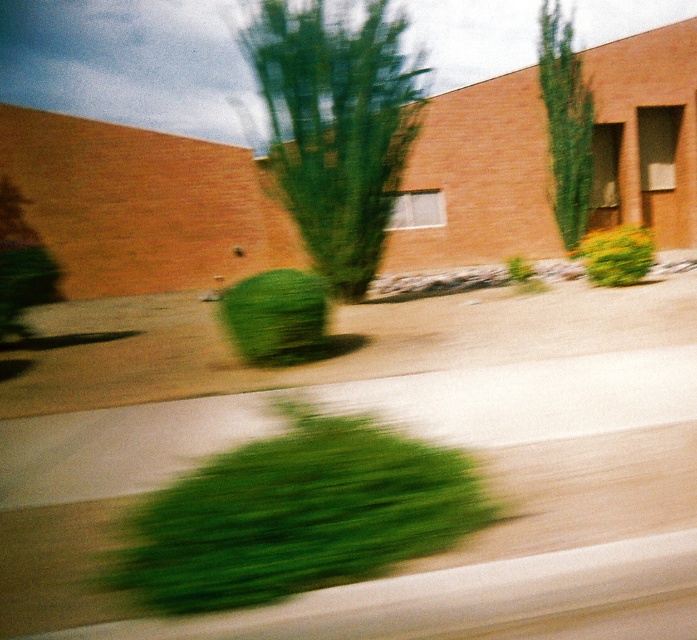
Who is more forward, [183,566] or [606,260]?

Point [183,566] is in front.

Can you confirm if green leafy hedge at lower center is wider than yellow-green textured bush at center-right?

No, green leafy hedge at lower center is not wider than yellow-green textured bush at center-right.

Is point (222, 486) farther from camera compared to point (574, 253)?

No, it is not.

Locate an element on the screen. The width and height of the screenshot is (697, 640). green leafy hedge at lower center is located at coordinates (296, 515).

Between green leafy tree at center and green leafy tree at upper center, which one is positioned lower?

green leafy tree at upper center is below.

How distant is green leafy tree at center from green leafy tree at upper center?

green leafy tree at center is 12.27 meters from green leafy tree at upper center.

Is point (381, 115) farther from viewer compared to point (544, 35)?

No, it is not.

Where is `green leafy tree at center`? The height and width of the screenshot is (640, 697). green leafy tree at center is located at coordinates (335, 125).

Between green fuzzy bush at center and yellow-green textured bush at center-right, which one appears on the left side from the viewer's perspective?

Positioned to the left is green fuzzy bush at center.

Is green fuzzy bush at center to the left of yellow-green textured bush at center-right from the viewer's perspective?

Indeed, green fuzzy bush at center is positioned on the left side of yellow-green textured bush at center-right.

This screenshot has width=697, height=640. What do you see at coordinates (275, 316) in the screenshot?
I see `green fuzzy bush at center` at bounding box center [275, 316].

Identify the location of green fuzzy bush at center. (275, 316).